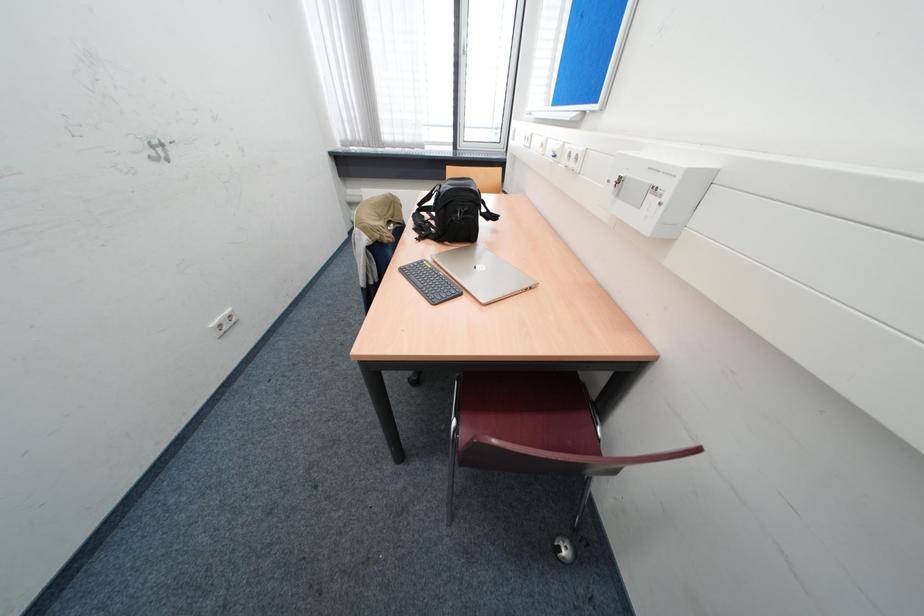
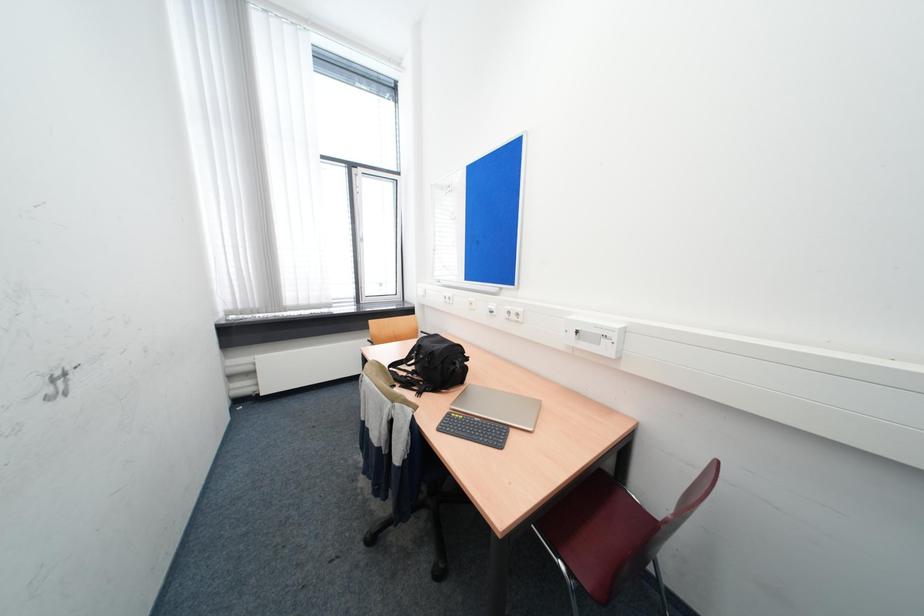
First-person continuous shooting, in which direction is the camera rotating?

The camera's rotation is toward right-up.